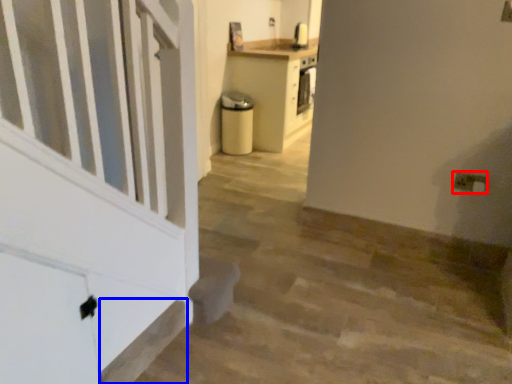
Question: Which object is further to the camera taking this photo, electric outlet (highlighted by a red box) or stairwell (highlighted by a blue box)?

Choices:
 (A) electric outlet
 (B) stairwell

Answer: (A)